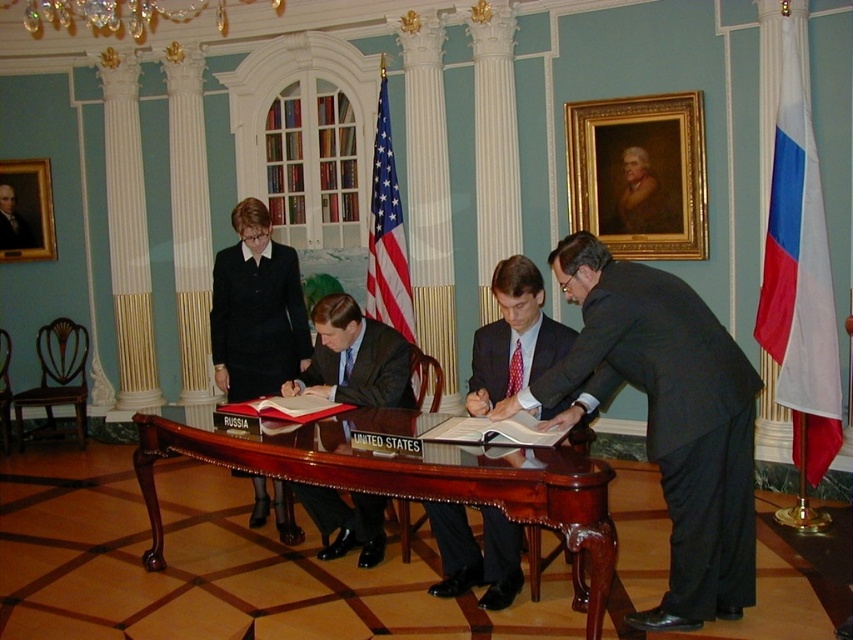
Does american flag at center appear on the left side of smooth black suit at center?

No, american flag at center is not to the left of smooth black suit at center.

Is american flag at center behind smooth black suit at center?

No, american flag at center is closer to the viewer.

Describe the element at coordinates (387, 232) in the screenshot. I see `american flag at center` at that location.

Locate an element on the screen. american flag at center is located at coordinates (387, 232).

Who is taller, black matte suit at center or dark blue suit at center?

Standing taller between the two is black matte suit at center.

Who is shorter, black matte suit at center or dark blue suit at center?

dark blue suit at center is shorter.

Which is in front, point (270, 320) or point (318, 340)?

Point (318, 340)

Where is `black matte suit at center`? The image size is (853, 640). black matte suit at center is located at coordinates (256, 308).

Which of these two, mahogany wood table at center or smooth black suit at center, stands shorter?

Standing shorter between the two is smooth black suit at center.

Can you confirm if mahogany wood table at center is positioned above smooth black suit at center?

No, mahogany wood table at center is not above smooth black suit at center.

Between point (227, 458) and point (3, 189), which one is positioned in front?

Point (227, 458) is more forward.

Image resolution: width=853 pixels, height=640 pixels. What are the coordinates of `mahogany wood table at center` in the screenshot? It's located at (404, 477).